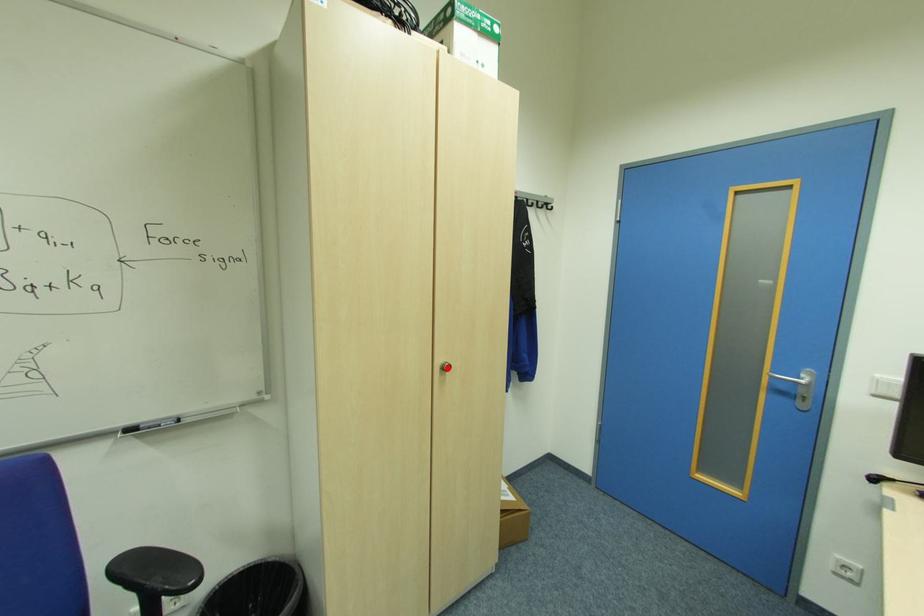
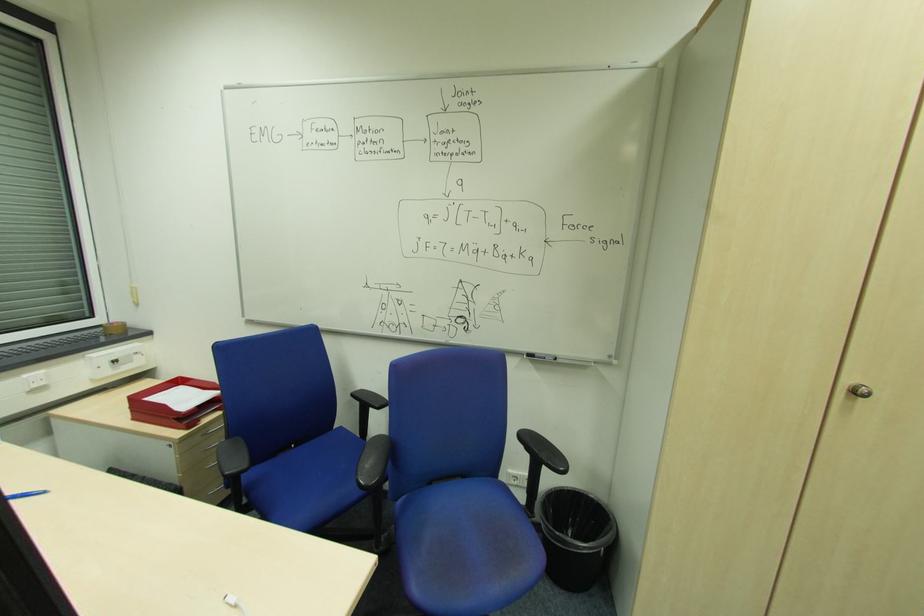
Question: I am providing you with two images of the same scene from different viewpoints. Given a red point in image1, look at the same physical point in image2. Is it:

Choices:
 (A) Closer to the viewpoint
 (B) Farther from the viewpoint

Answer: (A)